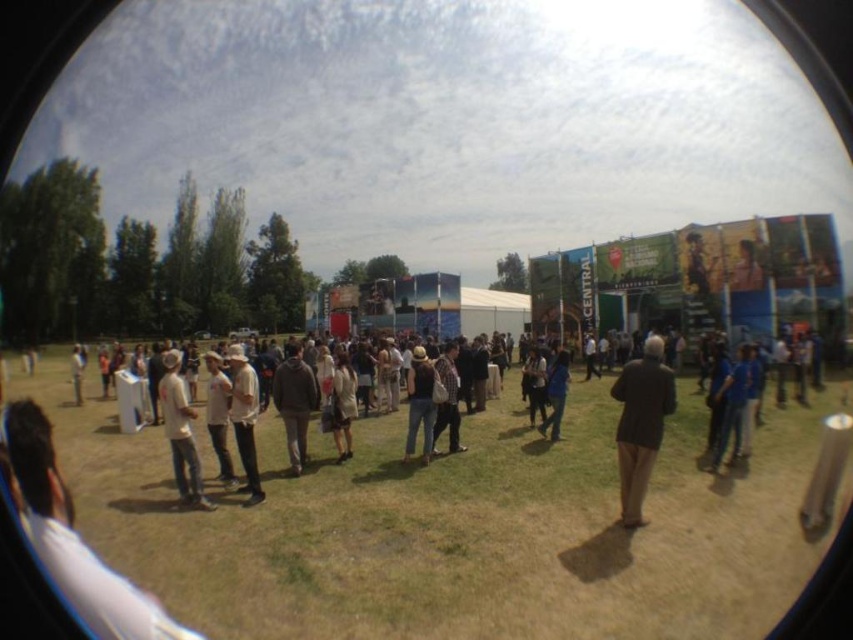
Question: Can you confirm if dark brown jacket at center is wider than light brown leather jacket at center?

Choices:
 (A) yes
 (B) no

Answer: (A)

Question: Which of the following is the farthest from the observer?

Choices:
 (A) (165, 410)
 (B) (236, 444)
 (C) (553, 401)
 (D) (314, 397)

Answer: (C)

Question: Does plaid shirt at center have a greater width compared to blue denim jeans at center?

Choices:
 (A) yes
 (B) no

Answer: (A)

Question: Among these points, which one is farthest from the camera?

Choices:
 (A) (561, 365)
 (B) (410, 374)

Answer: (A)

Question: Is dark brown jacket at center above blue denim jeans at center?

Choices:
 (A) no
 (B) yes

Answer: (B)

Question: Which of the following is the farthest from the observer?

Choices:
 (A) (440, 356)
 (B) (252, 401)
 (C) (170, 397)

Answer: (A)